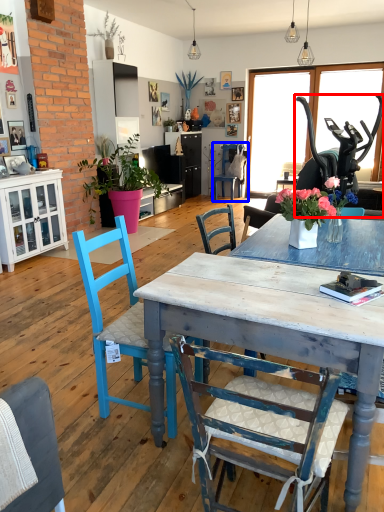
Question: Which object is further to the camera taking this photo, armchair (highlighted by a red box) or chair (highlighted by a blue box)?

Choices:
 (A) armchair
 (B) chair

Answer: (B)